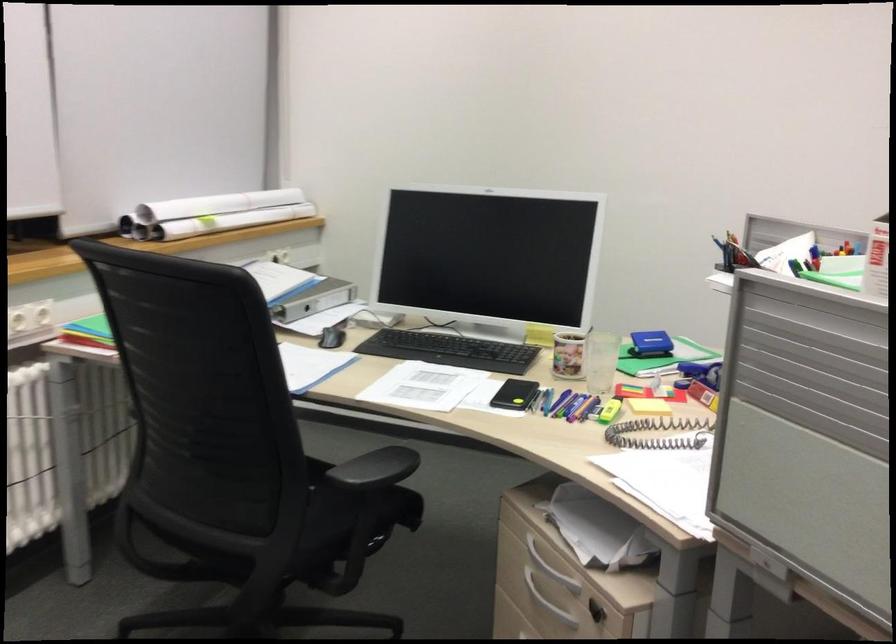
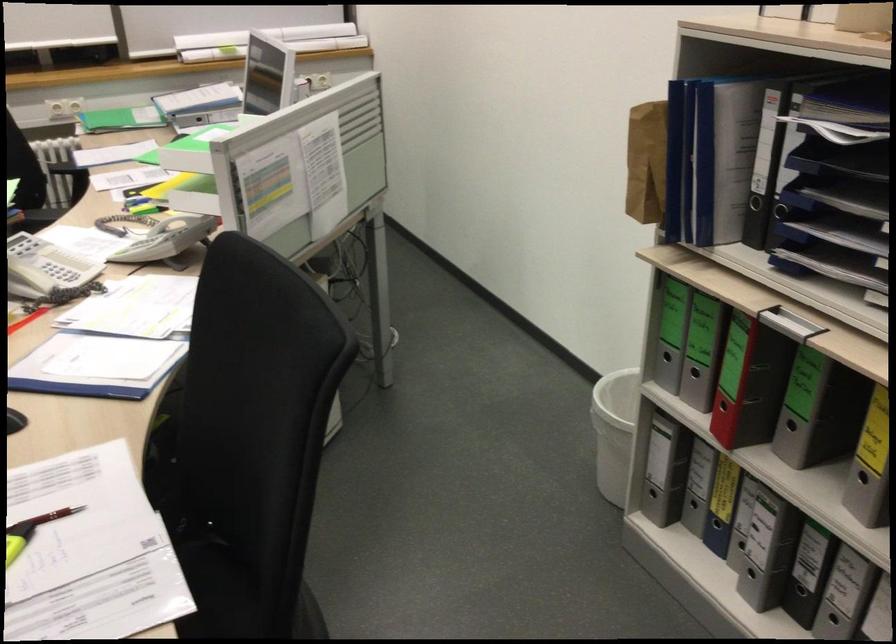
Question: I am providing you with two images of the same scene from different viewpoints. Which of the following objects are not visible in image2?

Choices:
 (A) chair sitting surface
 (B) black binder finger hole
 (C) clear blender pitcher
 (D) red binder finger hole

Answer: (A)